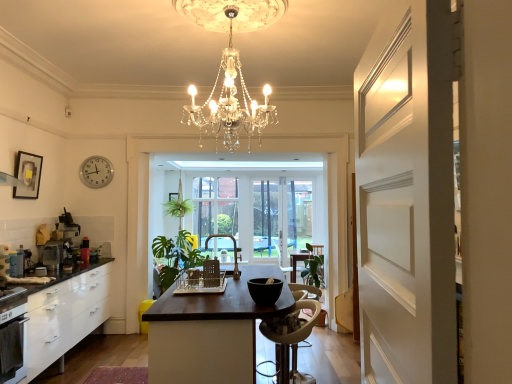
Question: From the image's perspective, is metallic silver toaster at left, acting as the second appliance starting from the front, over matte gold faucet at center, the 3th chair from the front?

Choices:
 (A) no
 (B) yes

Answer: (A)

Question: Can you confirm if metallic silver toaster at left, marked as the 1th appliance in a left-to-right arrangement, is taller than matte gold faucet at center, placed as the 1th chair when sorted from back to front?

Choices:
 (A) yes
 (B) no

Answer: (B)

Question: Is metallic silver toaster at left, marked as the 1th appliance in a left-to-right arrangement, in contact with matte gold faucet at center, placed as the 1th chair when sorted from back to front?

Choices:
 (A) no
 (B) yes

Answer: (A)

Question: Is matte gold faucet at center, the 3th chair from the front, located within metallic silver toaster at left, the 3th appliance when ordered from right to left?

Choices:
 (A) no
 (B) yes

Answer: (A)

Question: Is metallic silver toaster at left, marked as the 1th appliance in a left-to-right arrangement, completely or partially outside of matte gold faucet at center, positioned as the 1th chair in top-to-bottom order?

Choices:
 (A) no
 (B) yes

Answer: (B)

Question: Is white plastic clock at upper left situated inside white plastic chair at center, placed as the 3th chair when sorted from back to front, or outside?

Choices:
 (A) outside
 (B) inside

Answer: (A)

Question: From the image's perspective, is white plastic clock at upper left above or below white plastic chair at center, which is the 1th chair from right to left?

Choices:
 (A) below
 (B) above

Answer: (B)

Question: Looking at their shapes, would you say white plastic clock at upper left is wider or thinner than white plastic chair at center, which is the third chair in top-to-bottom order?

Choices:
 (A) wide
 (B) thin

Answer: (B)

Question: From a real-world perspective, is white plastic clock at upper left physically located above or below white plastic chair at center, which is counted as the 3th chair, starting from the left?

Choices:
 (A) above
 (B) below

Answer: (A)

Question: Is point (249, 334) positioned closer to the camera than point (42, 258)?

Choices:
 (A) farther
 (B) closer

Answer: (B)

Question: Visually, is dark brown wood table at center positioned to the left or to the right of metallic silver blender at left, the first appliance when ordered from back to front?

Choices:
 (A) left
 (B) right

Answer: (B)

Question: Is dark brown wood table at center bigger or smaller than metallic silver blender at left, which appears as the 2th appliance when viewed from the left?

Choices:
 (A) big
 (B) small

Answer: (A)

Question: In terms of width, does dark brown wood table at center look wider or thinner when compared to metallic silver blender at left, the second appliance viewed from the right?

Choices:
 (A) wide
 (B) thin

Answer: (A)

Question: In terms of size, does metallic silver toaster at left, the 3th appliance when ordered from right to left, appear bigger or smaller than white matte door at right?

Choices:
 (A) big
 (B) small

Answer: (B)

Question: Is metallic silver toaster at left, acting as the second appliance starting from the front, in front of or behind white matte door at right in the image?

Choices:
 (A) behind
 (B) front

Answer: (A)